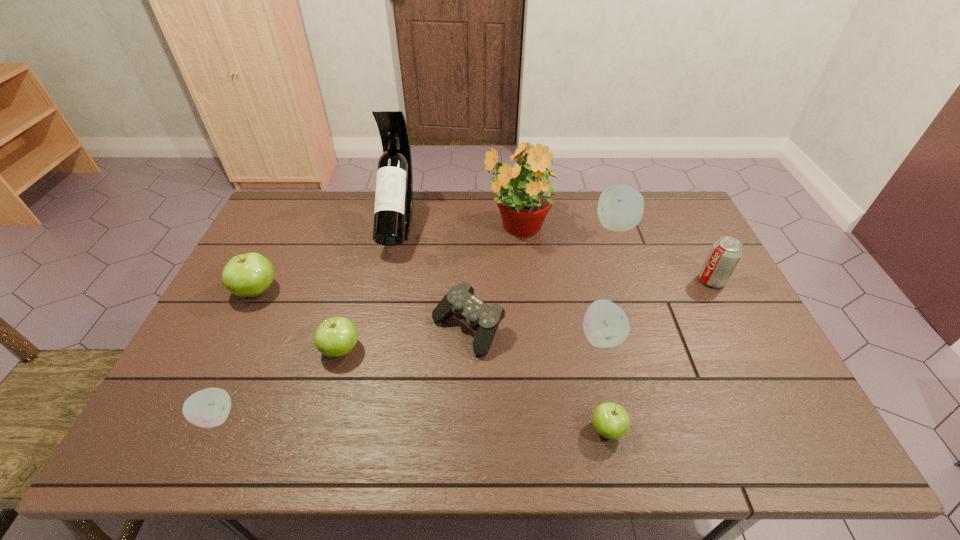
Locate which apple is the fourth closest to the second biggest green apple. Please provide its 2D coordinates. Your answer should be formatted as a tuple, i.e. [(x, y)], where the tuple contains the x and y coordinates of a point satisfying the conditions above.

[(605, 325)]

Find the location of a particular element. white apple that can be found as the second closest to the flowerpot is located at coordinates (605, 325).

You are a GUI agent. You are given a task and a screenshot of the screen. Output one action in this format:
    pyautogui.click(x=<x>, y=<y>)
    Task: Click on the second closest white apple to the nearest green apple
    
    Given the screenshot: What is the action you would take?
    pyautogui.click(x=620, y=208)

The width and height of the screenshot is (960, 540). What are the coordinates of `green apple that is the second closest one to the biggest white apple` in the screenshot? It's located at (334, 337).

Point out which green apple is positioned as the nearest to the biggest green apple. Please provide its 2D coordinates. Your answer should be formatted as a tuple, i.e. [(x, y)], where the tuple contains the x and y coordinates of a point satisfying the conditions above.

[(334, 337)]

You are a GUI agent. You are given a task and a screenshot of the screen. Output one action in this format:
    pyautogui.click(x=<x>, y=<y>)
    Task: Click on the free point that satisfies the following two spatial constraints: 1. on the stand of the wine bottle; 2. on the left side of the second nearest white apple
    The width and height of the screenshot is (960, 540).
    Given the screenshot: What is the action you would take?
    pyautogui.click(x=374, y=337)

The image size is (960, 540). I want to click on vacant region that satisfies the following two spatial constraints: 1. on the stand of the control; 2. on the right side of the wine bottle, so click(x=376, y=329).

I want to click on free spot that satisfies the following two spatial constraints: 1. on the stand of the second white apple from left to right; 2. on the left side of the black wine bottle, so click(374, 337).